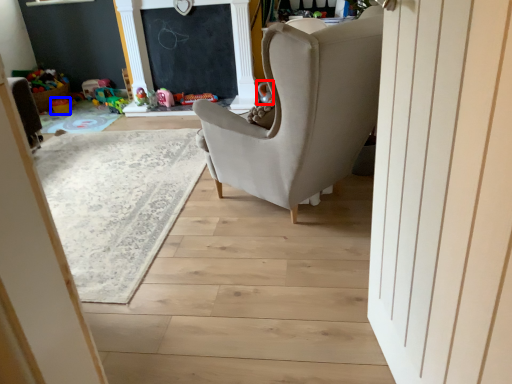
Question: Among these objects, which one is nearest to the camera, toy (highlighted by a red box) or toy (highlighted by a blue box)?

Choices:
 (A) toy
 (B) toy

Answer: (A)